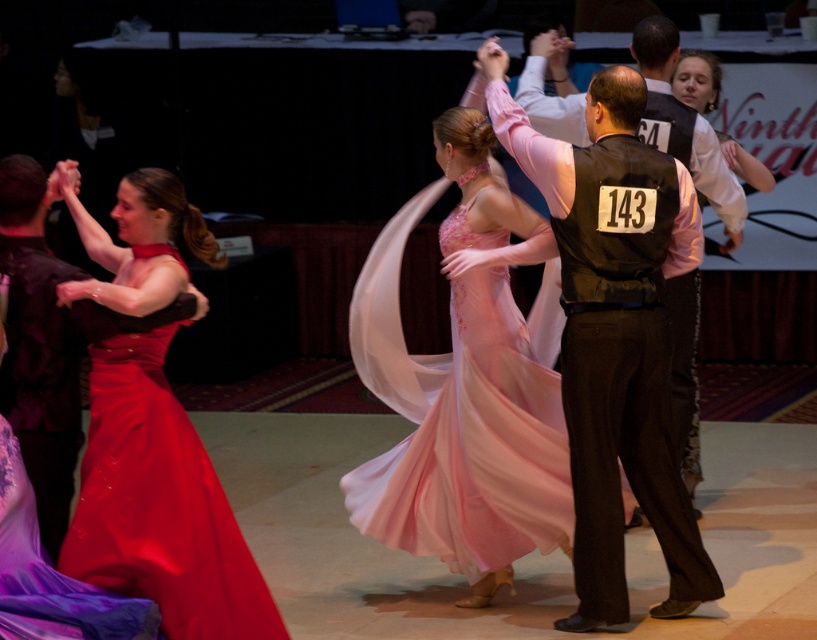
You are a photographer at the event and want to capture a photo of both the satin dress at left and the shiny satin dress at lower left. Based on their positions, which dress should you focus on first to ensure both are in frame?

A: The shiny satin dress at lower left is to the left of the satin dress at left, so focusing on the shiny satin dress at lower left first would ensure both are in frame as you pan to the right.

You are a photographer at the ballroom event and want to capture a photo of the pink satin dress at center and the shiny satin dress at lower left. From the photographer perspective, which dress is positioned to the right side?

The pink satin dress at center is positioned to the right of the shiny satin dress at lower left.